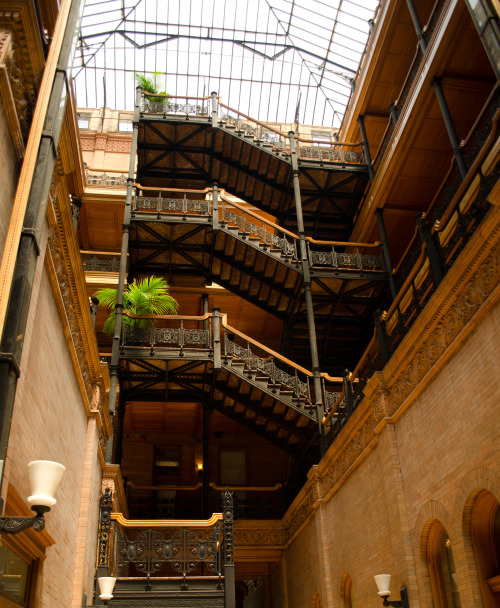
You are a GUI agent. You are given a task and a screenshot of the screen. Output one action in this format:
    pyautogui.click(x=<x>, y=<y>)
    Task: Click on the right wall
    
    Given the screenshot: What is the action you would take?
    pyautogui.click(x=415, y=474)